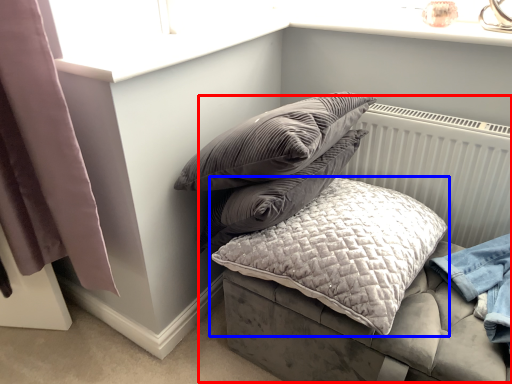
Question: Among these objects, which one is farthest to the camera, bed (highlighted by a red box) or pillow (highlighted by a blue box)?

Choices:
 (A) bed
 (B) pillow

Answer: (B)